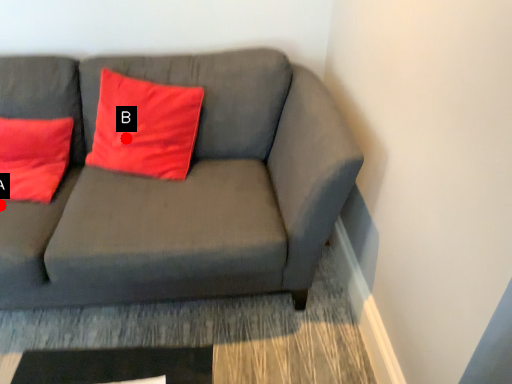
Question: Two points are circled on the image, labeled by A and B beside each circle. Which point is farther to the camera?

Choices:
 (A) A is further
 (B) B is further

Answer: (B)